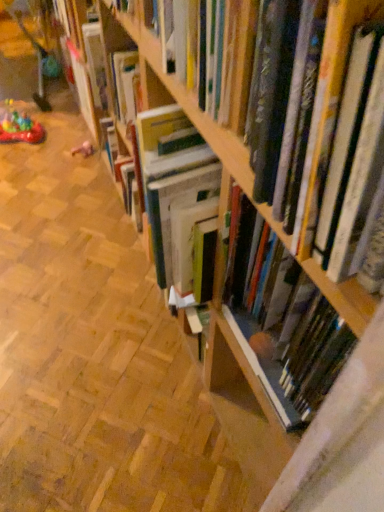
Question: Is the surface of hardcover book at center, which appears as the second book when viewed from the back, in direct contact with wooden bookshelf at center?

Choices:
 (A) yes
 (B) no

Answer: (B)

Question: From the image's perspective, is hardcover book at center, which appears as the second book when viewed from the back, below wooden bookshelf at center?

Choices:
 (A) yes
 (B) no

Answer: (B)

Question: Is hardcover book at center, marked as the 1th book in a front-to-back arrangement, positioned behind wooden bookshelf at center?

Choices:
 (A) no
 (B) yes

Answer: (A)

Question: Could wooden bookshelf at center be considered to be inside hardcover book at center, marked as the 1th book in a front-to-back arrangement?

Choices:
 (A) yes
 (B) no

Answer: (B)

Question: Is hardcover book at center, which appears as the second book when viewed from the back, not inside wooden bookshelf at center?

Choices:
 (A) no
 (B) yes

Answer: (B)

Question: Looking at their shapes, would you say hardcover book at center, the 2th book viewed from the front, is wider or thinner than hardcover book at center, which appears as the second book when viewed from the back?

Choices:
 (A) thin
 (B) wide

Answer: (A)

Question: In terms of size, does hardcover book at center, the 2th book viewed from the front, appear bigger or smaller than hardcover book at center, which appears as the second book when viewed from the back?

Choices:
 (A) big
 (B) small

Answer: (A)

Question: Does point (271, 329) appear closer or farther from the camera than point (225, 131)?

Choices:
 (A) farther
 (B) closer

Answer: (A)

Question: Considering the positions of hardcover book at center, arranged as the 1th book when viewed from the back, and hardcover book at center, marked as the 1th book in a front-to-back arrangement, in the image, is hardcover book at center, arranged as the 1th book when viewed from the back, taller or shorter than hardcover book at center, marked as the 1th book in a front-to-back arrangement,?

Choices:
 (A) tall
 (B) short

Answer: (A)

Question: In the image, is hardcover book at center, the 2th book viewed from the front, on the left side or the right side of pink fabric toy at lower left, acting as the 1th toy starting from the right?

Choices:
 (A) left
 (B) right

Answer: (B)

Question: From the image's perspective, relative to pink fabric toy at lower left, which ranks as the 2th toy in left-to-right order, is hardcover book at center, the 2th book viewed from the front, above or below?

Choices:
 (A) above
 (B) below

Answer: (B)

Question: Considering the positions of hardcover book at center, arranged as the 1th book when viewed from the back, and pink fabric toy at lower left, which ranks as the 2th toy in left-to-right order, in the image, is hardcover book at center, arranged as the 1th book when viewed from the back, bigger or smaller than pink fabric toy at lower left, which ranks as the 2th toy in left-to-right order,?

Choices:
 (A) small
 (B) big

Answer: (B)

Question: Looking at their shapes, would you say hardcover book at center, arranged as the 1th book when viewed from the back, is wider or thinner than pink fabric toy at lower left, acting as the 1th toy starting from the right?

Choices:
 (A) wide
 (B) thin

Answer: (A)

Question: From a real-world perspective, is wooden bookshelf at center physically located above or below hardcover book at center, arranged as the 1th book when viewed from the back?

Choices:
 (A) below
 (B) above

Answer: (A)

Question: Considering the positions of wooden bookshelf at center and hardcover book at center, the 2th book viewed from the front, in the image, is wooden bookshelf at center taller or shorter than hardcover book at center, the 2th book viewed from the front,?

Choices:
 (A) tall
 (B) short

Answer: (B)